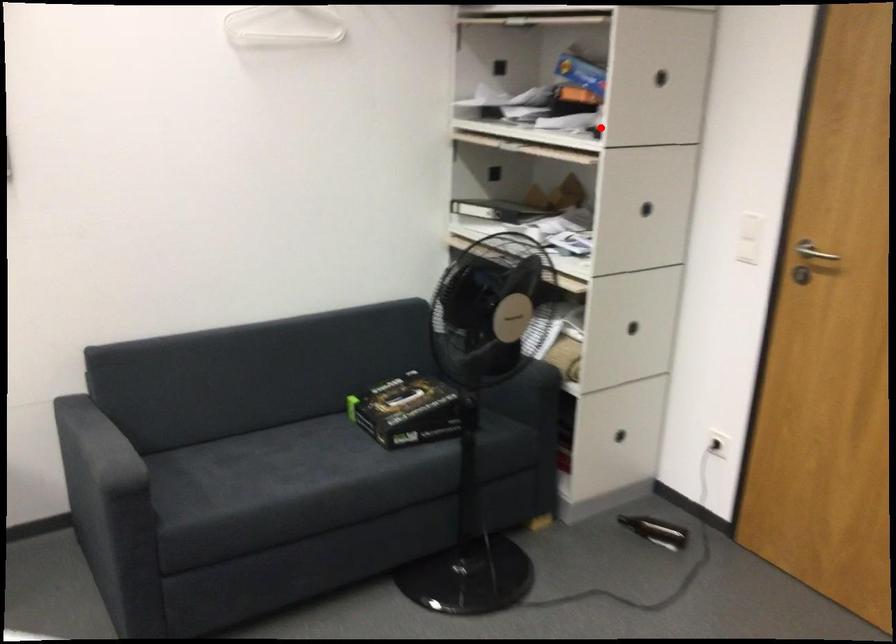
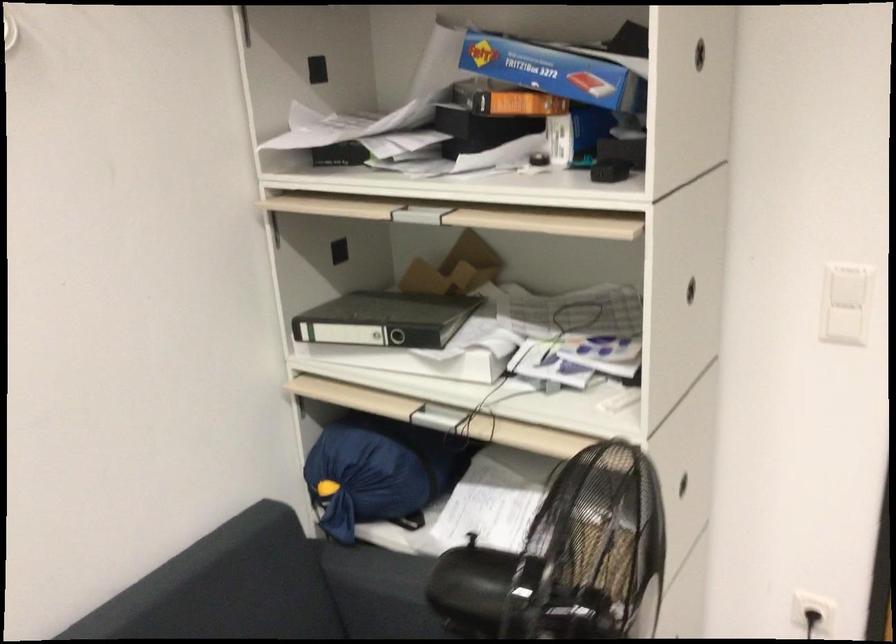
Question: I am providing you with two images of the same scene from different viewpoints. In image1, a red point is highlighted. Considering the same 3D point in image2, which of the following is correct?

Choices:
 (A) It is closer
 (B) It is farther

Answer: (A)